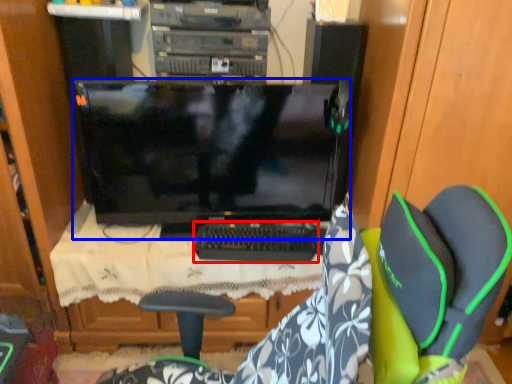
Question: Which of the following is the farthest to the observer, computer keyboard (highlighted by a red box) or computer monitor (highlighted by a blue box)?

Choices:
 (A) computer keyboard
 (B) computer monitor

Answer: (A)